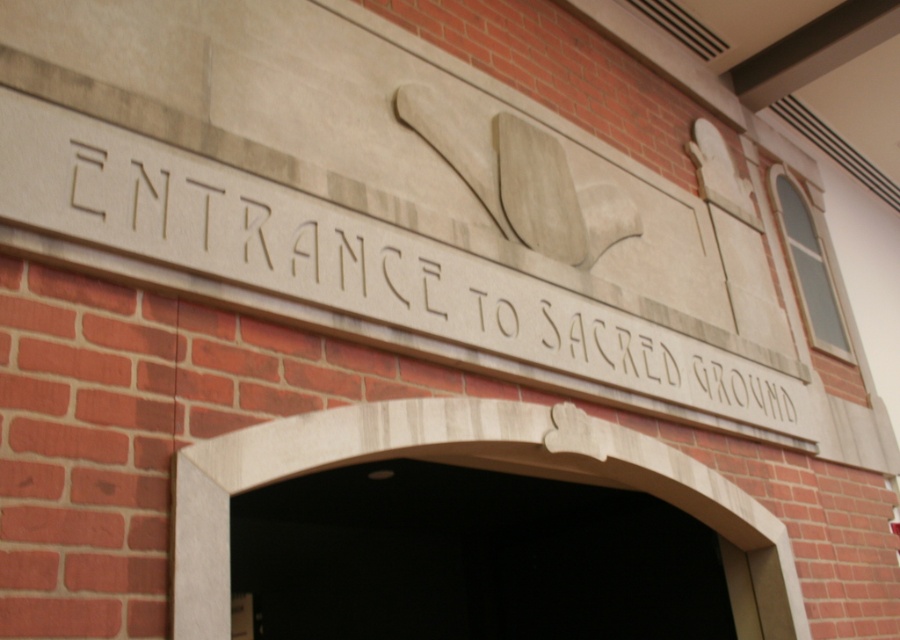
You are an architect examining the building facade. You notice the carved stone sign at center and the smooth stone arch at center. Based on their positions, which object is located to the right side of the other?

The carved stone sign at center is to the right of the smooth stone arch at center, so the carved stone sign at center is located to the right of the smooth stone arch at center.

You are an architect analyzing the building facade. You observe the carved stone sign at center and the smooth stone arch at center. Based on their positions, which one do you think extends further to the left?

The carved stone sign at center might be wider than smooth stone arch at center, so it likely extends further to the left.